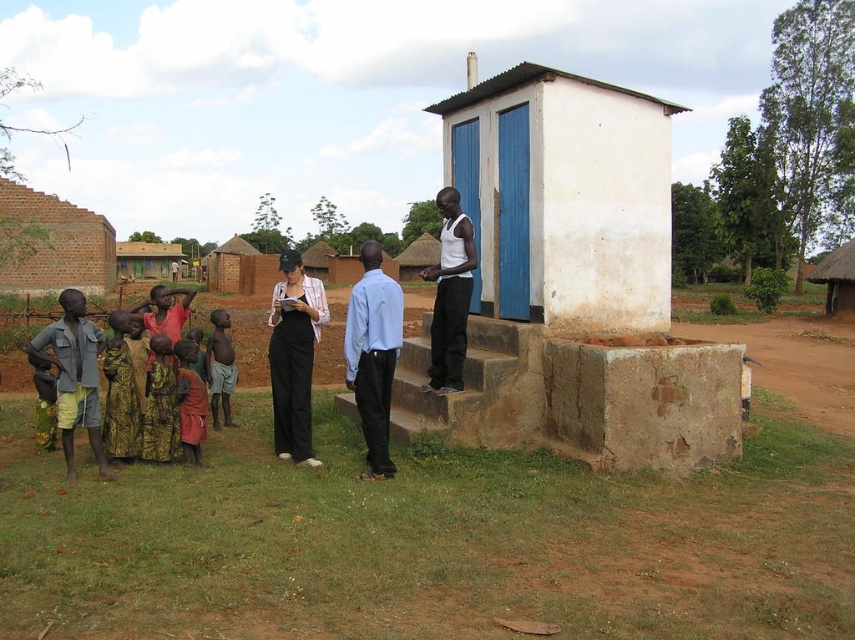
Question: Estimate the real-world distances between objects in this image. Which object is closer to the light brown skin at center?

Choices:
 (A) brown dirt field at lower left
 (B) thatched roof hut at upper right
 (C) white painted wood at upper right
 (D) black fabric pants at center

Answer: (D)

Question: Which point is farther to the camera?

Choices:
 (A) tap(351, 349)
 (B) tap(167, 268)

Answer: (B)

Question: Which of these objects is positioned closest to the brown dirt field at lower left?

Choices:
 (A) light brown skin at center
 (B) brown mud hut at left
 (C) white painted wood at upper right
 (D) black fabric pants at center

Answer: (C)

Question: Does brick wall at left have a smaller size compared to brown mud hut at left?

Choices:
 (A) no
 (B) yes

Answer: (B)

Question: Does black fabric pants at center have a lesser width compared to brown mud hut at left?

Choices:
 (A) yes
 (B) no

Answer: (A)

Question: Can you confirm if white painted wood at upper right is positioned above black fabric pants at center?

Choices:
 (A) yes
 (B) no

Answer: (A)